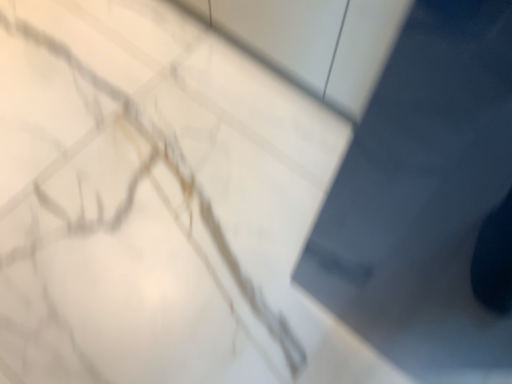
What do you see at coordinates (120, 221) in the screenshot? Image resolution: width=512 pixels, height=384 pixels. I see `white marble crack at center` at bounding box center [120, 221].

What is the approximate height of white marble crack at center?

white marble crack at center is 1.47 inches in height.

The width and height of the screenshot is (512, 384). In order to click on white marble crack at center in this screenshot , I will do `click(120, 221)`.

This screenshot has width=512, height=384. In order to click on white marble crack at center in this screenshot , I will do `click(120, 221)`.